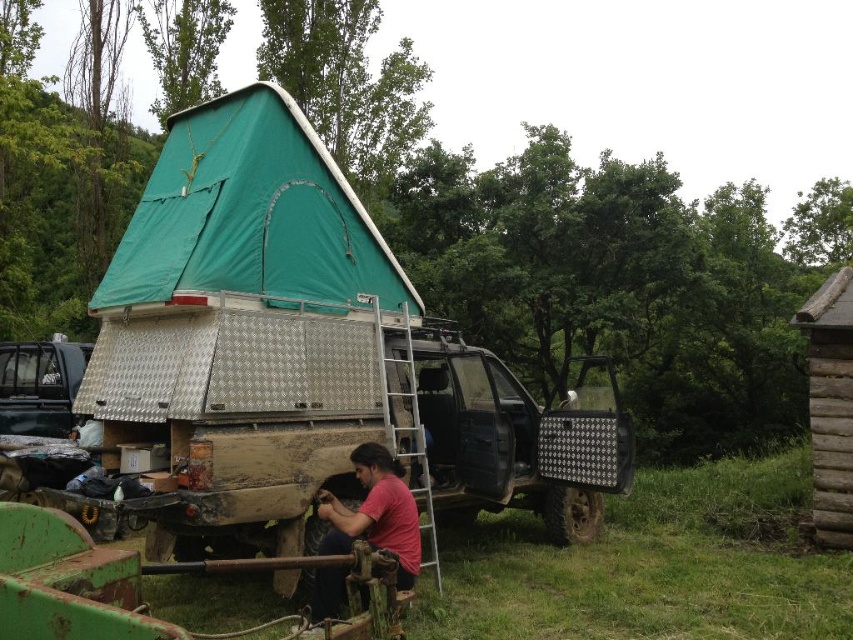
From the picture: Between green fabric tent at upper left and brushed metal truck at left, which one appears on the right side from the viewer's perspective?

green fabric tent at upper left

I want to click on green fabric tent at upper left, so pyautogui.click(x=248, y=317).

Which is in front, point (149, 298) or point (10, 342)?

Point (149, 298)

The image size is (853, 640). Identify the location of green fabric tent at upper left. (248, 317).

Looking at this image, can you confirm if pink matte shirt at center is positioned to the right of brushed metal truck at left?

Yes, pink matte shirt at center is to the right of brushed metal truck at left.

Between point (374, 492) and point (41, 404), which one is positioned behind?

Positioned behind is point (41, 404).

The height and width of the screenshot is (640, 853). Describe the element at coordinates (375, 513) in the screenshot. I see `pink matte shirt at center` at that location.

Where is `pink matte shirt at center`? The image size is (853, 640). pink matte shirt at center is located at coordinates (375, 513).

You are a GUI agent. You are given a task and a screenshot of the screen. Output one action in this format:
    pyautogui.click(x=<x>, y=<y>)
    Task: Click on the brown wooden hut at right
    The height and width of the screenshot is (640, 853).
    Given the screenshot: What is the action you would take?
    pyautogui.click(x=830, y=404)

Does brown wooden hut at right appear over pink matte shirt at center?

Yes, brown wooden hut at right is above pink matte shirt at center.

This screenshot has height=640, width=853. I want to click on brown wooden hut at right, so click(x=830, y=404).